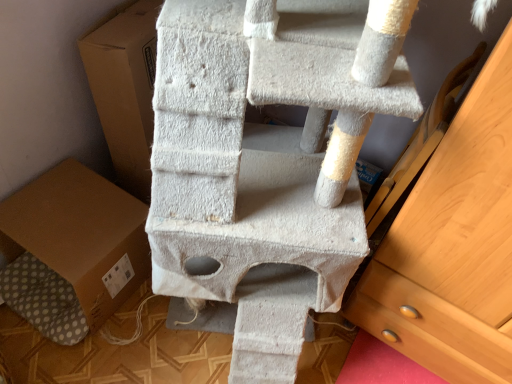
What are the coordinates of `blank space above brown cardboard box at lower left (from a real-world perspective)` in the screenshot? It's located at (66, 217).